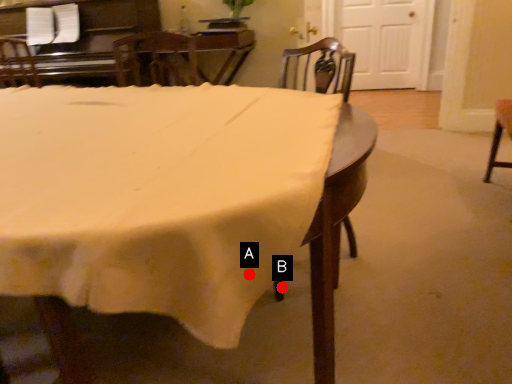
Question: Two points are circled on the image, labeled by A and B beside each circle. Which point is further to the camera?

Choices:
 (A) A is further
 (B) B is further

Answer: (B)